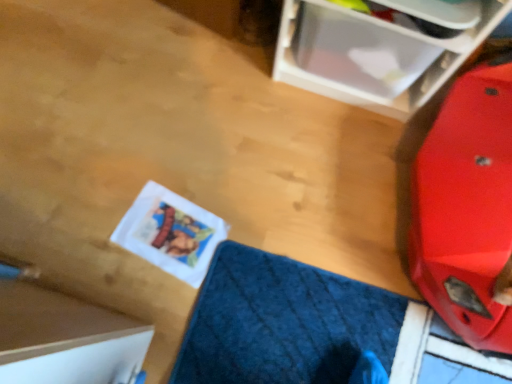
Image resolution: width=512 pixels, height=384 pixels. I want to click on vacant area in front of transparent plastic drawer at upper right, so click(324, 164).